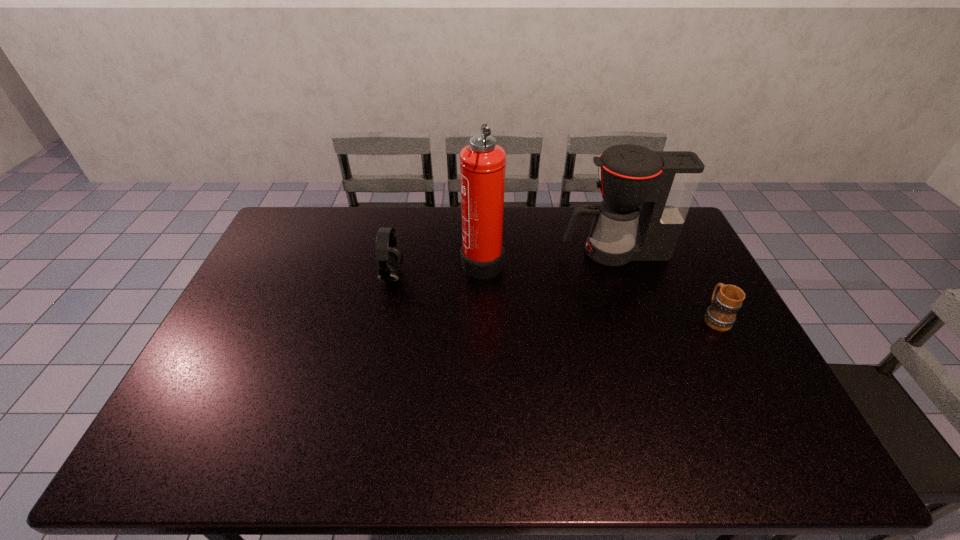
Where is `blank area in the image that satisfies the following two spatial constraints: 1. pour from the carafe of the third object from left to right; 2. on the side of the shortest object with the handle`? The image size is (960, 540). blank area in the image that satisfies the following two spatial constraints: 1. pour from the carafe of the third object from left to right; 2. on the side of the shortest object with the handle is located at coordinates (637, 318).

This screenshot has height=540, width=960. What are the coordinates of `vacant area that satisfies the following two spatial constraints: 1. on the side of the rightmost object with the handle; 2. on the ear cups of the second shortest object` in the screenshot? It's located at (694, 276).

What are the coordinates of `vacant space that satisfies the following two spatial constraints: 1. on the side of the rightmost object with the handle; 2. on the front-facing side of the fire extinguisher` in the screenshot? It's located at (685, 260).

You are a GUI agent. You are given a task and a screenshot of the screen. Output one action in this format:
    pyautogui.click(x=<x>, y=<y>)
    Task: Click on the free point that satisfies the following two spatial constraints: 1. on the side of the rightmost object with the handle; 2. on the front-facing side of the fire extinguisher
    The width and height of the screenshot is (960, 540).
    Given the screenshot: What is the action you would take?
    pyautogui.click(x=685, y=260)